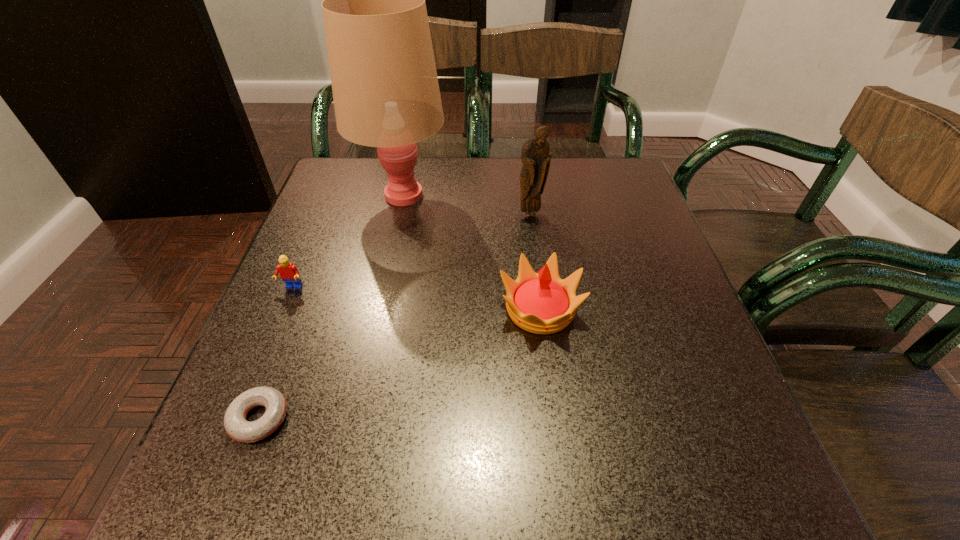
The height and width of the screenshot is (540, 960). What are the coordinates of `free space at the far left corner of the desktop` in the screenshot? It's located at (368, 179).

Where is `vacant area at the far right corner of the desktop`? vacant area at the far right corner of the desktop is located at coordinates (624, 204).

Locate an element on the screen. free space between the tallest object and the third tallest object is located at coordinates (471, 252).

This screenshot has width=960, height=540. What are the coordinates of `vacant space in between the lampshade and the nearest object` in the screenshot? It's located at (330, 306).

Identify the location of unoccupied position between the doughnut and the Lego. (276, 353).

At what (x,y) coordinates should I click in order to perform the action: click on unoccupied area between the fourth shortest object and the fourth tallest object. Please return your answer as a coordinate pair (x, y). The image size is (960, 540). Looking at the image, I should click on (411, 251).

At what (x,y) coordinates should I click in order to perform the action: click on free space between the tallest object and the crown. Please return your answer as a coordinate pair (x, y). This screenshot has height=540, width=960. Looking at the image, I should click on (471, 252).

Locate an element on the screen. Image resolution: width=960 pixels, height=540 pixels. free area in between the second shortest object and the third tallest object is located at coordinates (416, 299).

You are a GUI agent. You are given a task and a screenshot of the screen. Output one action in this format:
    pyautogui.click(x=<x>, y=<y>)
    Task: Click on the vacant region between the crown and the Lego
    Image resolution: width=960 pixels, height=540 pixels.
    Given the screenshot: What is the action you would take?
    pyautogui.click(x=416, y=299)

What are the coordinates of `unoccupied position between the Lego and the nearest object` in the screenshot? It's located at (276, 353).